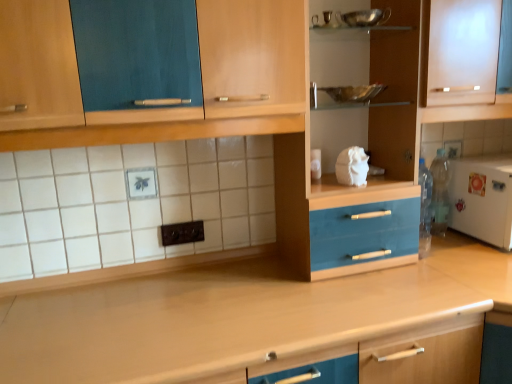
Question: Is frosted glass cabinet at upper right taller than white matte refrigerator at right?

Choices:
 (A) no
 (B) yes

Answer: (B)

Question: Is white matte refrigerator at right a part of frosted glass cabinet at upper right?

Choices:
 (A) no
 (B) yes

Answer: (A)

Question: Could you tell me if frosted glass cabinet at upper right is facing white matte refrigerator at right?

Choices:
 (A) yes
 (B) no

Answer: (B)

Question: Is the surface of frosted glass cabinet at upper right in direct contact with white matte refrigerator at right?

Choices:
 (A) yes
 (B) no

Answer: (B)

Question: Does frosted glass cabinet at upper right have a larger size compared to white matte refrigerator at right?

Choices:
 (A) yes
 (B) no

Answer: (A)

Question: From a real-world perspective, is frosted glass cabinet at upper right positioned above or below white matte refrigerator at right?

Choices:
 (A) above
 (B) below

Answer: (A)

Question: In terms of size, does frosted glass cabinet at upper right appear bigger or smaller than white matte refrigerator at right?

Choices:
 (A) big
 (B) small

Answer: (A)

Question: From the image's perspective, is frosted glass cabinet at upper right positioned above or below white matte refrigerator at right?

Choices:
 (A) below
 (B) above

Answer: (B)

Question: Is frosted glass cabinet at upper right situated inside white matte refrigerator at right or outside?

Choices:
 (A) outside
 (B) inside

Answer: (A)

Question: Is metallic silver bowl at upper center in front of or behind white matte refrigerator at right in the image?

Choices:
 (A) front
 (B) behind

Answer: (A)

Question: Considering the positions of point (316, 11) and point (454, 223), is point (316, 11) closer or farther from the camera than point (454, 223)?

Choices:
 (A) farther
 (B) closer

Answer: (B)

Question: Is metallic silver bowl at upper center situated inside white matte refrigerator at right or outside?

Choices:
 (A) outside
 (B) inside

Answer: (A)

Question: Considering the relative positions of metallic silver bowl at upper center and white matte refrigerator at right in the image provided, is metallic silver bowl at upper center to the left or to the right of white matte refrigerator at right?

Choices:
 (A) left
 (B) right

Answer: (A)

Question: From their relative heights in the image, would you say wooden at center is taller or shorter than white matte refrigerator at right?

Choices:
 (A) short
 (B) tall

Answer: (B)

Question: Looking at the image, does wooden at center seem bigger or smaller compared to white matte refrigerator at right?

Choices:
 (A) small
 (B) big

Answer: (B)